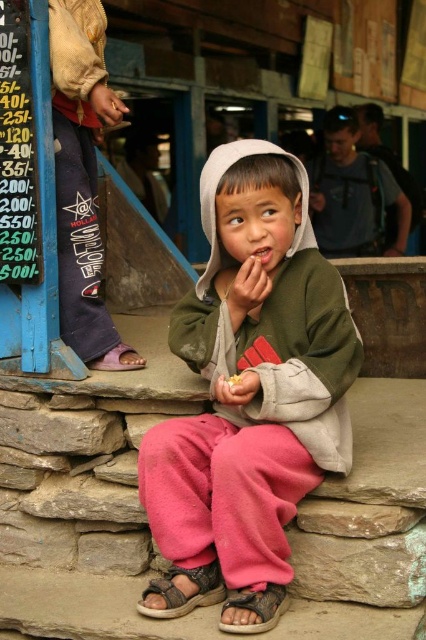
Question: Which object is the closest to the brown textured sandal at lower center?

Choices:
 (A) smooth yellowish hand at center
 (B) brown leather sandal at lower left

Answer: (A)

Question: Is smooth yellowish hand at center above yellow crumbly food at center?

Choices:
 (A) yes
 (B) no

Answer: (B)

Question: Which of the following is the farthest from the observer?

Choices:
 (A) (308, 362)
 (B) (236, 381)
 (C) (264, 612)
 (D) (244, 394)

Answer: (A)

Question: Does pink fleece pants at center appear under brown textured sandal at lower center?

Choices:
 (A) yes
 (B) no

Answer: (B)

Question: Based on their relative distances, which object is farther from the yellow crumbly food at center?

Choices:
 (A) pink fleece pants at center
 (B) brown leather sandal at lower center

Answer: (B)

Question: Can you confirm if pink fleece pants at center is wider than brown textured sandal at lower center?

Choices:
 (A) no
 (B) yes

Answer: (B)